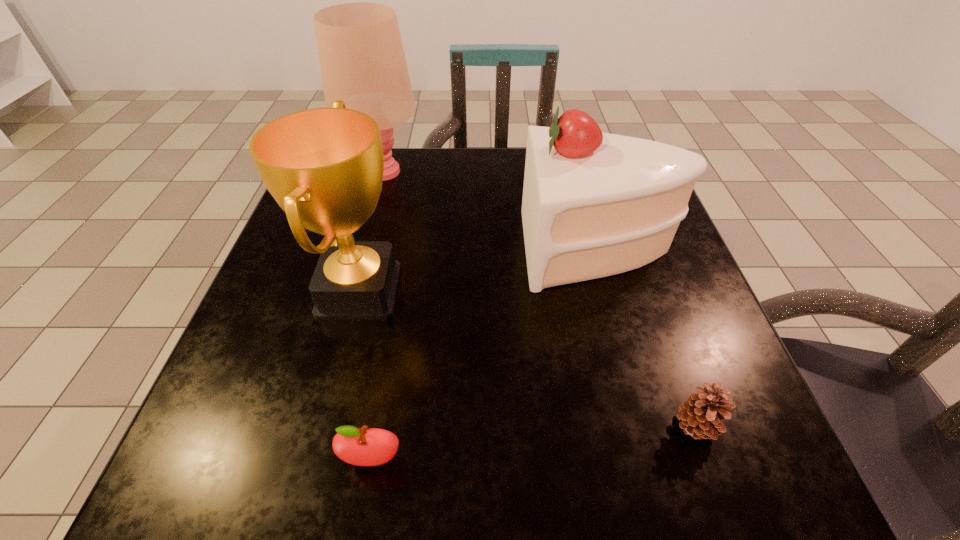
Image resolution: width=960 pixels, height=540 pixels. I want to click on vacant space that satisfies the following two spatial constraints: 1. on the front-facing side of the award; 2. on the back side of the pinecone, so click(x=324, y=426).